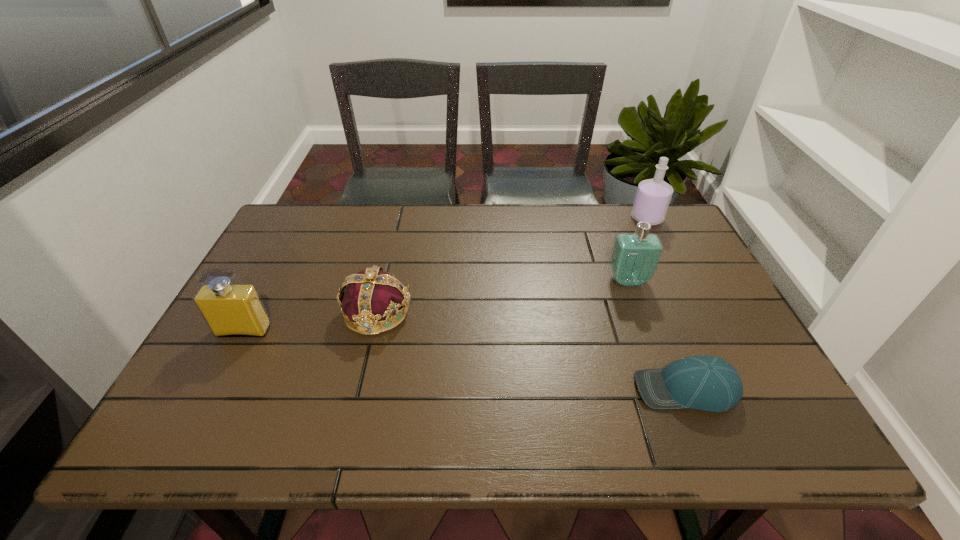
At what (x,y) coordinates should I click in order to perform the action: click on vacant area situated 0.110m on the front-facing side of the leftmost object. Please return your answer as a coordinate pair (x, y). Looking at the image, I should click on (219, 377).

Identify the location of vacant space located 0.300m on the back of the fourth object from right to left. This screenshot has width=960, height=540. point(398,224).

Locate an element on the screen. The image size is (960, 540). free location located 0.160m on the left of the nearest object is located at coordinates (562, 390).

This screenshot has height=540, width=960. Find the location of `object at the far edge`. object at the far edge is located at coordinates (653, 196).

Locate an element on the screen. The width and height of the screenshot is (960, 540). object located in the near edge section of the desktop is located at coordinates (707, 383).

Where is `object located at the left edge`? object located at the left edge is located at coordinates (229, 309).

Locate an element on the screen. The image size is (960, 540). perfume that is positioned at the right edge is located at coordinates (653, 196).

The width and height of the screenshot is (960, 540). I want to click on baseball cap that is positioned at the right edge, so click(707, 383).

Image resolution: width=960 pixels, height=540 pixels. Find the location of `object located in the far right corner section of the desktop`. object located in the far right corner section of the desktop is located at coordinates (653, 196).

Identify the location of object at the near right corner. This screenshot has width=960, height=540. pyautogui.click(x=707, y=383).